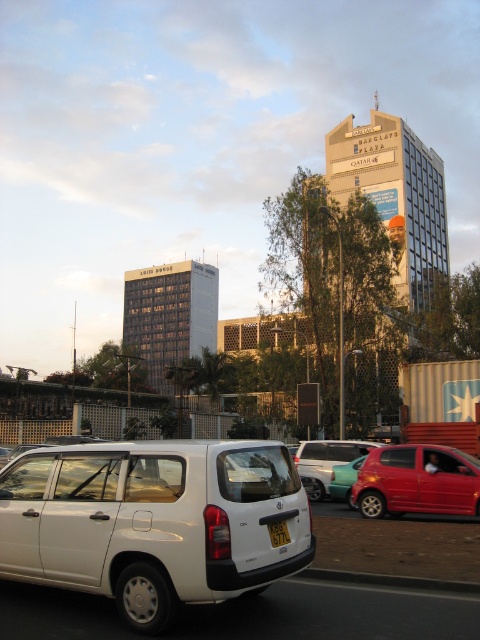
Consider the image. You are a delivery person trying to park your van between the glossy red car at lower right and the teal glossy sedan at center. Can your van, which is 2.2 meters wide, fit in the space between them?

The glossy red car at lower right is wider than the teal glossy sedan at center. However, the exact distance between them isn t provided, so we can t determine if the van will fit. More information is needed about the space between the two vehicles.

In the scene shown: You are a parking attendant and need to verify the license plate of the metallic silver car at center. Is the yellow matte license plate at center the correct one for that car?

The metallic silver car at center is positioned under the yellow matte license plate at center, so yes, the yellow matte license plate at center is the correct one for that car.

You are a delivery driver who needs to park your vehicle in a tight space between the glossy red car at lower right and the metallic silver car at center. Based on their heights, can you determine which car you should position your vehicle closer to in order to maximize vertical clearance?

The glossy red car at lower right is not as tall as the metallic silver car at center, so positioning your vehicle closer to the glossy red car at lower right will provide more vertical clearance due to its lower height.